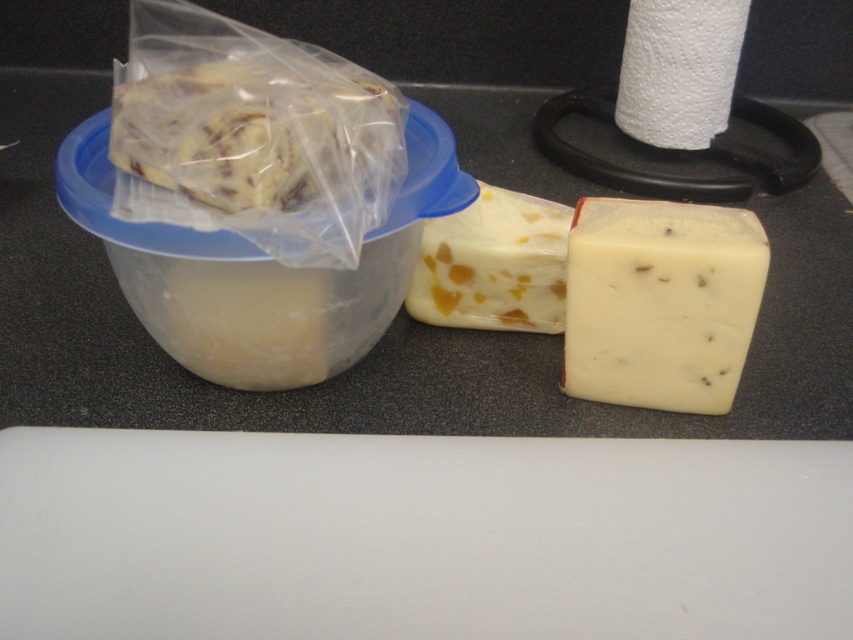
You are organizing a cheese platter and have both the white creamy cheese at center and the yellow crumbly cheese at center. Which cheese should you choose if you need a larger portion for a crowd?

The white creamy cheese at center has a larger size compared to the yellow crumbly cheese at center, so it would be better to choose the white creamy cheese at center for a larger portion.